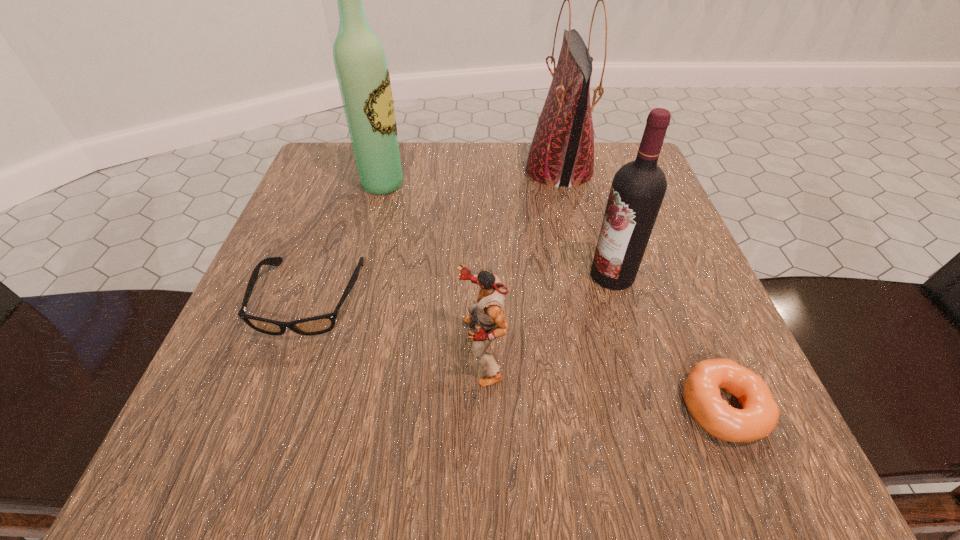
At what (x,y) coordinates should I click in order to perform the action: click on vacant point that satisfies the following two spatial constraints: 1. on the label of the shorter wine bottle; 2. on the front-facing side of the spectacles. Please return your answer as a coordinate pair (x, y). This screenshot has width=960, height=540. Looking at the image, I should click on (619, 298).

Identify the location of vacant position in the image that satisfies the following two spatial constraints: 1. on the front-facing side of the spectacles; 2. on the right side of the doughnut. (271, 407).

This screenshot has width=960, height=540. Identify the location of free space that satisfies the following two spatial constraints: 1. on the front side of the doughnut; 2. on the left side of the handbag. (613, 407).